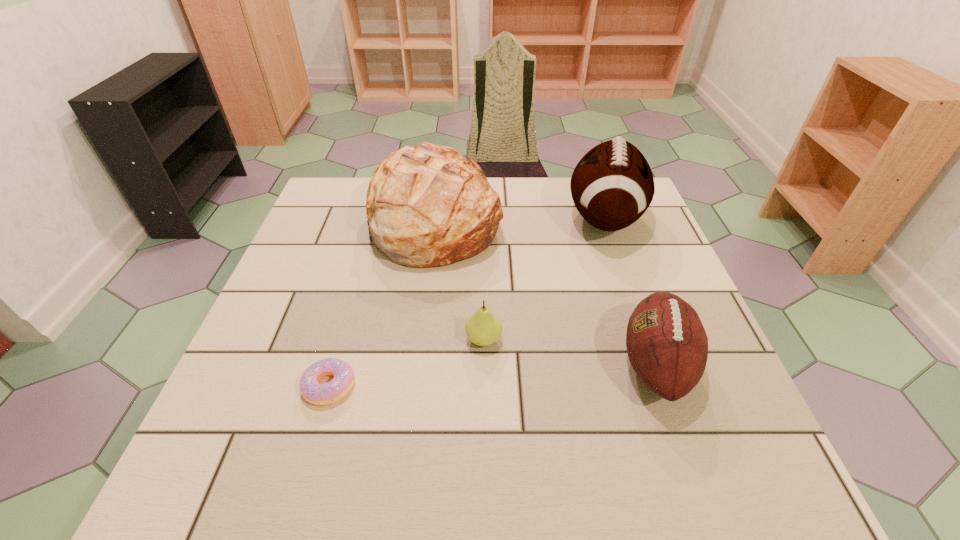
The height and width of the screenshot is (540, 960). Find the location of `vacant space located 0.210m on the right of the shortest object`. vacant space located 0.210m on the right of the shortest object is located at coordinates (468, 386).

At what (x,y) coordinates should I click in order to perform the action: click on bread that is at the far edge. Please return your answer as a coordinate pair (x, y). Looking at the image, I should click on (428, 206).

You are a GUI agent. You are given a task and a screenshot of the screen. Output one action in this format:
    pyautogui.click(x=<x>, y=<y>)
    Task: Click on the football (American) present at the far edge
    
    Given the screenshot: What is the action you would take?
    pyautogui.click(x=612, y=186)

Find the location of `bread at the left edge`. bread at the left edge is located at coordinates (428, 206).

Identify the location of doughnut that is at the left edge. The image size is (960, 540). (319, 394).

At what (x,y) coordinates should I click in order to perform the action: click on object positioned at the far left corner. Please return your answer as a coordinate pair (x, y). Looking at the image, I should click on (428, 206).

Locate an element on the screen. Image resolution: width=960 pixels, height=540 pixels. object positioned at the far right corner is located at coordinates (612, 186).

The width and height of the screenshot is (960, 540). In the image, there is a desktop. What are the coordinates of `vacant space at the far edge` in the screenshot? It's located at click(508, 210).

In the image, there is a desktop. Where is `free space at the left edge`? This screenshot has height=540, width=960. free space at the left edge is located at coordinates (255, 417).

The image size is (960, 540). I want to click on vacant space at the right edge of the desktop, so click(x=748, y=426).